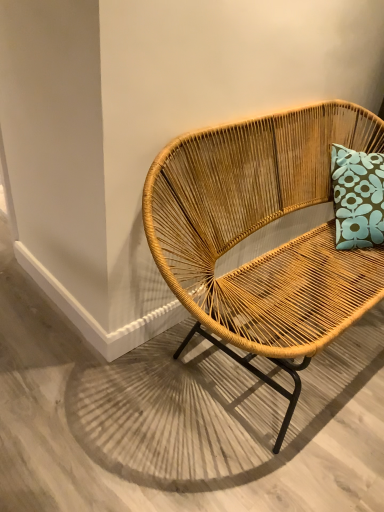
Question: Relative to natural wood chair at center, is natural woven chair at center in front or behind?

Choices:
 (A) behind
 (B) front

Answer: (B)

Question: From the image's perspective, is natural woven chair at center positioned above or below natural wood chair at center?

Choices:
 (A) above
 (B) below

Answer: (A)

Question: Is natural woven chair at center to the left or to the right of natural wood chair at center in the image?

Choices:
 (A) left
 (B) right

Answer: (B)

Question: Looking at the image, does natural wood chair at center seem bigger or smaller compared to natural woven chair at center?

Choices:
 (A) big
 (B) small

Answer: (B)

Question: From a real-world perspective, relative to natural woven chair at center, is natural wood chair at center vertically above or below?

Choices:
 (A) above
 (B) below

Answer: (B)

Question: From the image's perspective, is natural wood chair at center located above or below natural woven chair at center?

Choices:
 (A) above
 (B) below

Answer: (B)

Question: Is natural wood chair at center in front of or behind natural woven chair at center in the image?

Choices:
 (A) behind
 (B) front

Answer: (A)